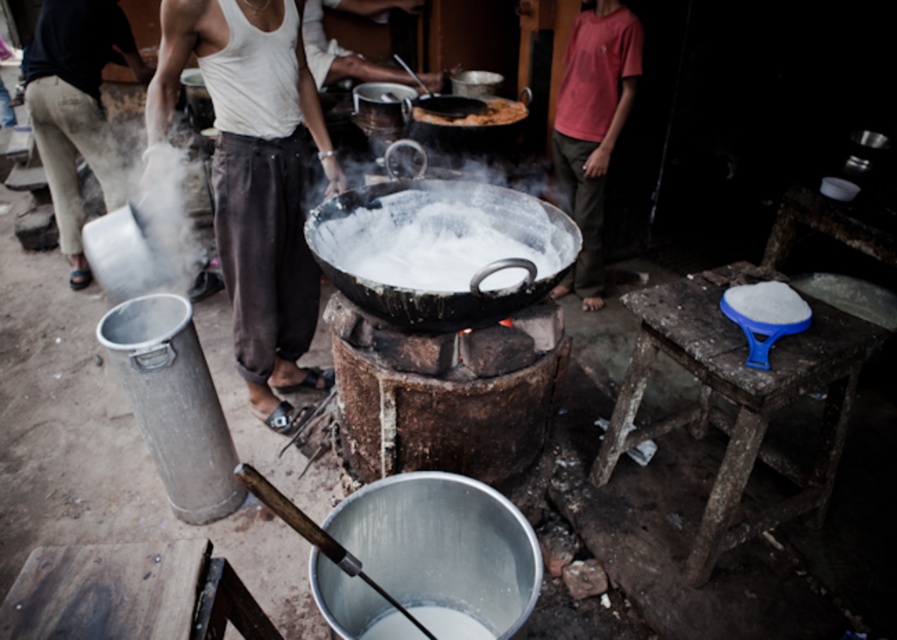
Question: Can you confirm if black matte wok at center is smaller than red cotton shirt at right?

Choices:
 (A) yes
 (B) no

Answer: (A)

Question: Observing the image, what is the correct spatial positioning of white cotton tank top at center in reference to red cotton shirt at right?

Choices:
 (A) above
 (B) below

Answer: (B)

Question: Among these points, which one is farthest from the camera?

Choices:
 (A) (46, 122)
 (B) (527, 195)
 (C) (723, 326)
 (D) (208, 276)

Answer: (D)

Question: Which object is the farthest from the blue plastic stool at lower right?

Choices:
 (A) brown matte flatbread at center
 (B) red cotton shirt at right
 (C) white vapor at left
 (D) black matte wok at center

Answer: (C)

Question: Which is nearer to the blue plastic stool at lower right?

Choices:
 (A) white cotton tank top at center
 (B) red cotton shirt at right
 (C) black matte wok at center

Answer: (C)

Question: Observing the image, what is the correct spatial positioning of white vapor at left in reference to brown matte flatbread at center?

Choices:
 (A) above
 (B) below

Answer: (B)